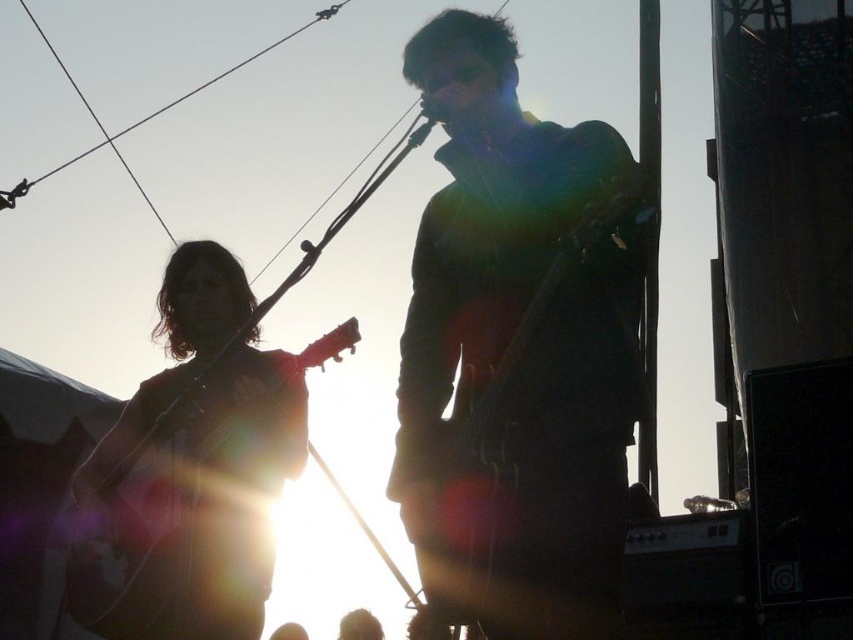
Question: Is wooden acoustic guitar at left in front of matte black guitar at center?

Choices:
 (A) yes
 (B) no

Answer: (B)

Question: Which object appears closest to the camera in this image?

Choices:
 (A) matte black guitar at center
 (B) wooden acoustic guitar at left

Answer: (A)

Question: Which point appears farthest from the camera in this image?

Choices:
 (A) (462, 422)
 (B) (294, 385)

Answer: (B)

Question: Is wooden acoustic guitar at left positioned at the back of matte black guitar at center?

Choices:
 (A) yes
 (B) no

Answer: (A)

Question: From the image, what is the correct spatial relationship of wooden acoustic guitar at left in relation to matte black guitar at center?

Choices:
 (A) left
 (B) right

Answer: (A)

Question: Which object appears closest to the camera in this image?

Choices:
 (A) wooden acoustic guitar at left
 (B) matte black guitar at center

Answer: (B)